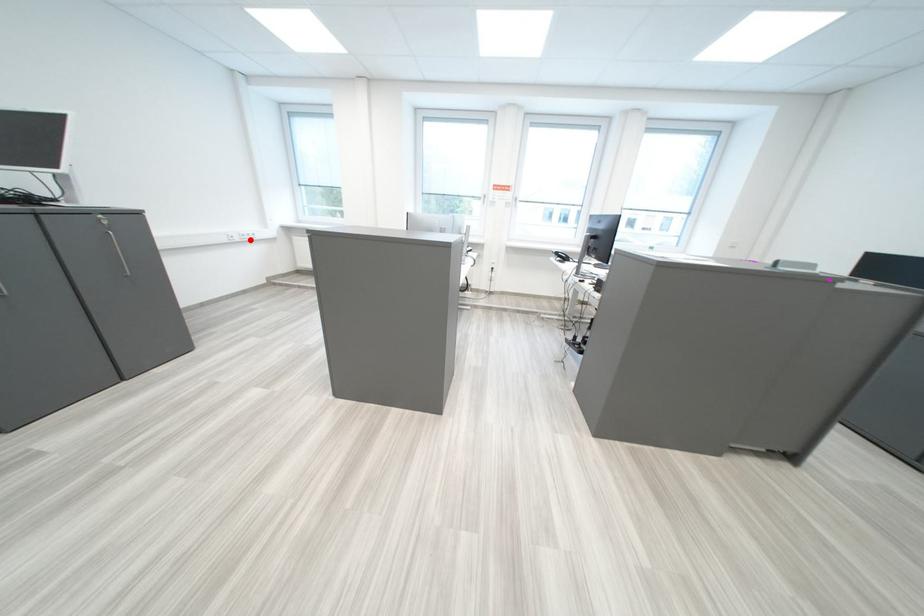
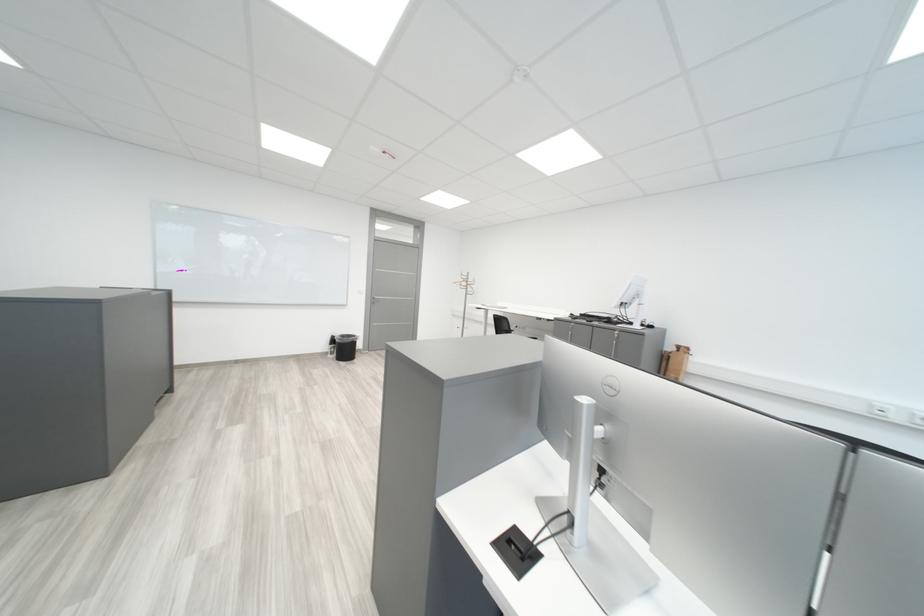
Find the pixel in the second image that matches the highlighted location in the first image.

(910, 419)